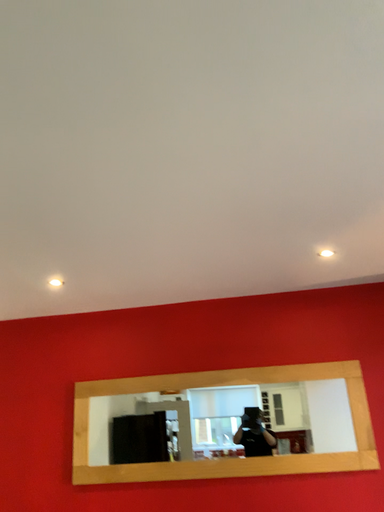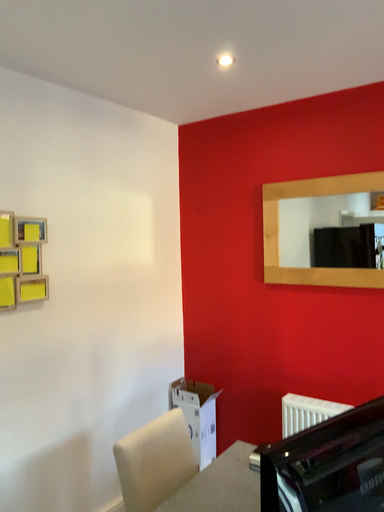
Question: Which way did the camera rotate in the video?

Choices:
 (A) rotated downward
 (B) rotated upward

Answer: (A)